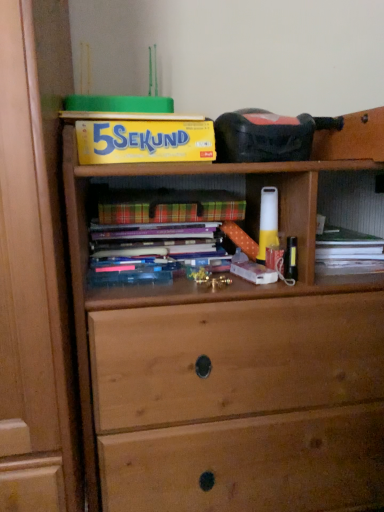
Question: Relative to yellow cardboard box at upper center, acting as the 2th paperback book starting from the bottom, is plaid paper at center, arranged as the second paperback book when viewed from the top, in front or behind?

Choices:
 (A) behind
 (B) front

Answer: (A)

Question: Is plaid paper at center, arranged as the 1th paperback book when ordered from the bottom, bigger or smaller than yellow cardboard box at upper center, acting as the 2th paperback book starting from the bottom?

Choices:
 (A) small
 (B) big

Answer: (A)

Question: Considering the real-world distances, which object is farthest from the hardcover book at center?

Choices:
 (A) yellow cardboard box at upper center, acting as the 2th paperback book starting from the bottom
 (B) plaid paper at center, arranged as the 1th paperback book when ordered from the bottom

Answer: (A)

Question: Estimate the real-world distances between objects in this image. Which object is farther from the yellow cardboard box at upper center, which appears as the 1th paperback book when viewed from the top?

Choices:
 (A) plaid paper at center, arranged as the 1th paperback book when ordered from the bottom
 (B) hardcover book at center

Answer: (B)